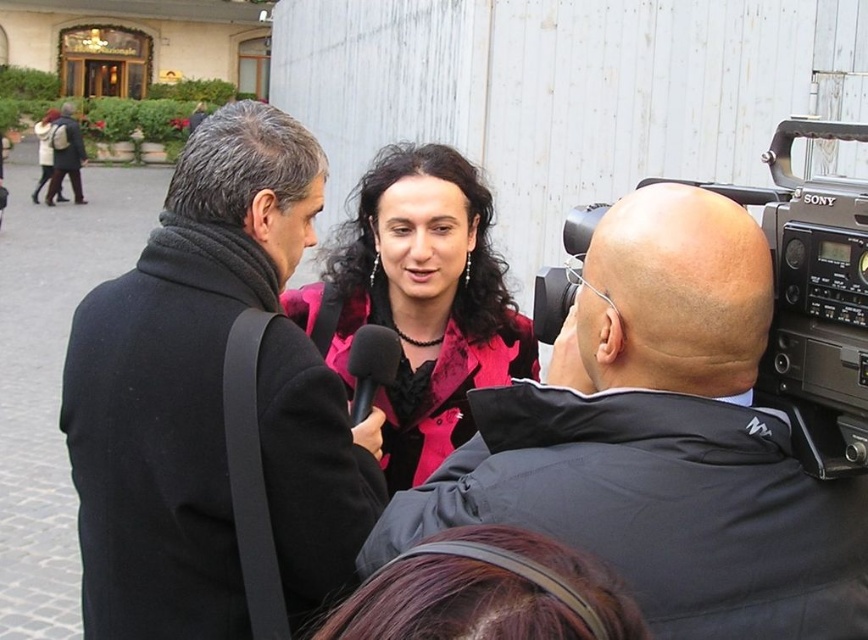
You are a photographer trying to capture both the black matte jacket at center and the black wool coat at left in a single frame. Based on their sizes, which one should you focus on to ensure both fit well in the photo?

The black matte jacket at center is wider than the black wool coat at left. To ensure both fit well in the photo, focus on the black matte jacket at center since it takes up more space, allowing the narrower black wool coat at left to fit alongside it.

You are a photographer standing at the scene. You need to take a photo that includes both the black matte jacket at center and the black wool coat at left. What is the minimum distance you should maintain from the nearest object to ensure both are in frame?

The black matte jacket at center is 3.34 feet away from the black wool coat at left. To include both in the photo, you should maintain a distance of at least 3.34 feet from the nearest object, which is the black wool coat at left, to ensure both are in frame.

You are a photographer trying to capture a clear shot of the black matte microphone at center during the interview. However, the black wool coat at left is blocking your view. Can you determine if the microphone is visible behind the coat?

The black wool coat at left is in front of the black matte microphone at center, so the microphone is not visible behind the coat.